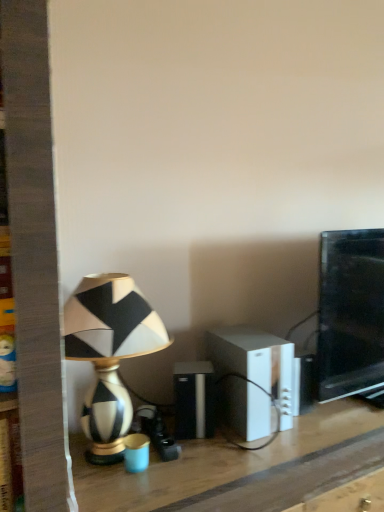
Question: Is the position of white plastic speaker at center, which is the 2th speaker from left to right, more distant than that of black plastic speaker at center, which is the first speaker from left to right?

Choices:
 (A) no
 (B) yes

Answer: (A)

Question: Considering the relative sizes of white plastic speaker at center, acting as the first speaker starting from the right, and black plastic speaker at center, the 2th speaker from the right, in the image provided, is white plastic speaker at center, acting as the first speaker starting from the right, shorter than black plastic speaker at center, the 2th speaker from the right,?

Choices:
 (A) no
 (B) yes

Answer: (A)

Question: Can you confirm if white plastic speaker at center, which is the 2th speaker from left to right, is thinner than black plastic speaker at center, which is the first speaker from left to right?

Choices:
 (A) no
 (B) yes

Answer: (A)

Question: From the image's perspective, is white plastic speaker at center, which is the 2th speaker from left to right, over black plastic speaker at center, which is the first speaker from left to right?

Choices:
 (A) yes
 (B) no

Answer: (A)

Question: Does white plastic speaker at center, acting as the first speaker starting from the right, have a greater height compared to black plastic speaker at center, the 2th speaker from the right?

Choices:
 (A) no
 (B) yes

Answer: (B)

Question: Does white plastic speaker at center, which is the 2th speaker from left to right, appear on the left side of black plastic speaker at center, the 2th speaker from the right?

Choices:
 (A) yes
 (B) no

Answer: (B)

Question: Does wooden table at center contain black glossy monitor at right?

Choices:
 (A) no
 (B) yes

Answer: (A)

Question: From a real-world perspective, is wooden table at center physically above black glossy monitor at right?

Choices:
 (A) yes
 (B) no

Answer: (B)

Question: Is black glossy monitor at right at the back of wooden table at center?

Choices:
 (A) no
 (B) yes

Answer: (A)

Question: From a real-world perspective, is wooden table at center beneath black glossy monitor at right?

Choices:
 (A) yes
 (B) no

Answer: (A)

Question: Does wooden table at center have a greater width compared to black glossy monitor at right?

Choices:
 (A) no
 (B) yes

Answer: (B)

Question: Is wooden table at center facing towards black glossy monitor at right?

Choices:
 (A) yes
 (B) no

Answer: (B)

Question: Can you confirm if white plastic speaker at center, which is the 2th speaker from left to right, is smaller than black and white ceramic lamp at left?

Choices:
 (A) yes
 (B) no

Answer: (A)